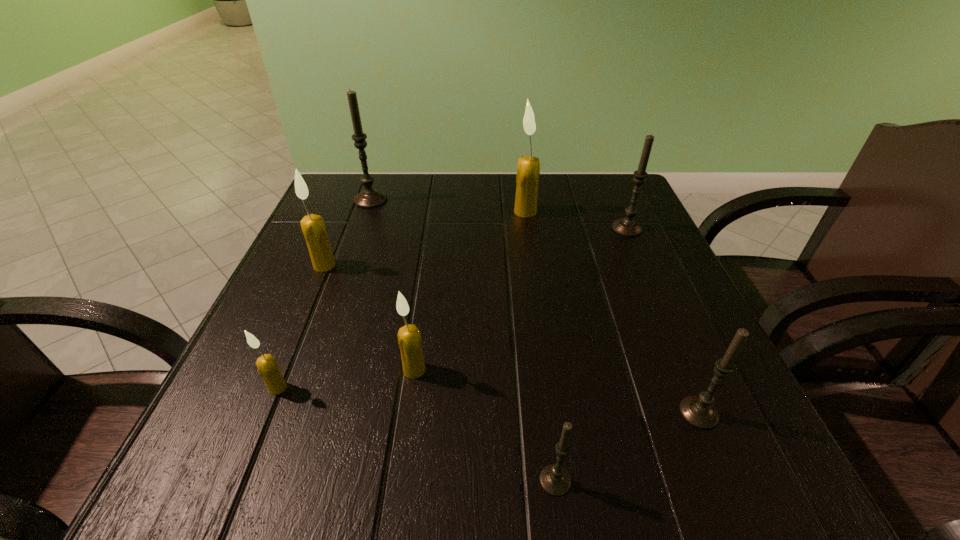
Where is `vacant space situated 0.160m on the left of the third farthest cream candle`? vacant space situated 0.160m on the left of the third farthest cream candle is located at coordinates (304, 370).

Where is `free space located 0.320m on the back of the seventh farthest candle`? Image resolution: width=960 pixels, height=540 pixels. free space located 0.320m on the back of the seventh farthest candle is located at coordinates (636, 264).

The width and height of the screenshot is (960, 540). I want to click on vacant area situated 0.390m on the right of the sixth farthest object, so click(538, 388).

At what (x,y) coordinates should I click in order to perform the action: click on free space located 0.050m on the left of the nearest candle. Please return your answer as a coordinate pair (x, y). The width and height of the screenshot is (960, 540). Looking at the image, I should click on (501, 481).

You are a GUI agent. You are given a task and a screenshot of the screen. Output one action in this format:
    pyautogui.click(x=<x>, y=<y>)
    Task: Click on the object situated at the near edge
    
    Given the screenshot: What is the action you would take?
    click(555, 480)

This screenshot has width=960, height=540. Identify the location of object that is at the far left corner. (369, 198).

The image size is (960, 540). Find the location of `object at the far right corner`. object at the far right corner is located at coordinates (627, 226).

At what (x,y) coordinates should I click in order to perform the action: click on free region at the far edge. Please return your answer as a coordinate pair (x, y). The height and width of the screenshot is (540, 960). Looking at the image, I should click on (538, 210).

This screenshot has height=540, width=960. What are the coordinates of `vacant space at the near edge of the desktop` in the screenshot? It's located at (496, 494).

In the image, there is a desktop. At what (x,y) coordinates should I click in order to perform the action: click on free space at the left edge. Please return your answer as a coordinate pair (x, y). This screenshot has height=540, width=960. Looking at the image, I should click on (290, 261).